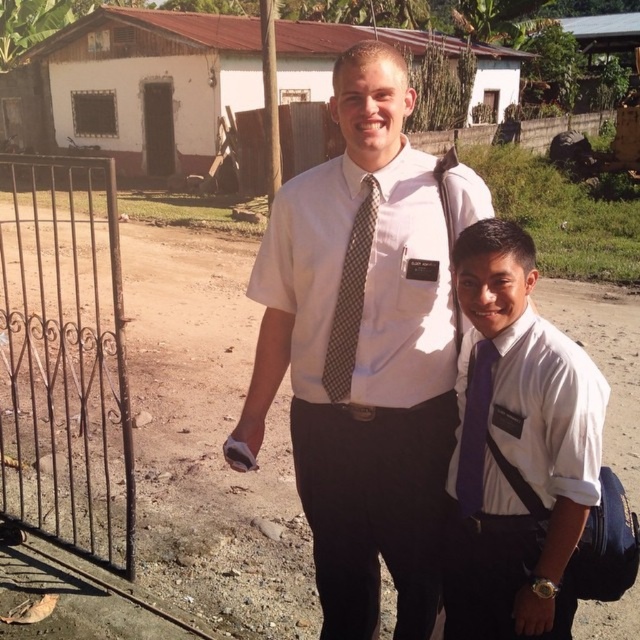
Question: Which object is closer to the camera taking this photo?

Choices:
 (A) white shirt at center
 (B) white painted wood hut at upper center

Answer: (A)

Question: Which is farther from the purple silk tie at right?

Choices:
 (A) white painted wood hut at upper center
 (B) brown dirt track at center
 (C) purple satin tie at right
 (D) brown dotted tie at center

Answer: (A)

Question: Can you confirm if white shirt at center is wider than purple silk tie at right?

Choices:
 (A) yes
 (B) no

Answer: (A)

Question: Can you confirm if brown dirt track at center is bigger than brown dotted tie at center?

Choices:
 (A) no
 (B) yes

Answer: (B)

Question: Which object is the closest to the brown dirt track at center?

Choices:
 (A) purple silk tie at right
 (B) brown dotted tie at center
 (C) white painted wood hut at upper center

Answer: (A)

Question: Does brown dirt track at center appear on the right side of purple silk tie at right?

Choices:
 (A) yes
 (B) no

Answer: (B)